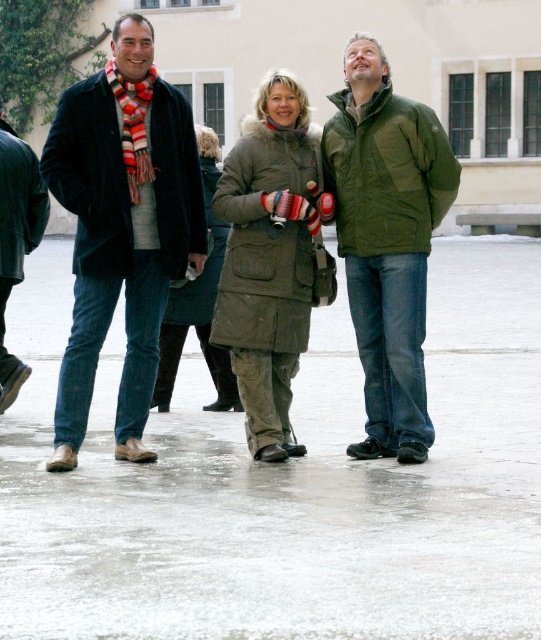
Is velvet black coat at left thinner than matte black jacket at left?

Indeed, velvet black coat at left has a lesser width compared to matte black jacket at left.

Does velvet black coat at left come in front of matte black jacket at left?

Yes, it is in front of matte black jacket at left.

Describe the element at coordinates (122, 227) in the screenshot. This screenshot has height=640, width=541. I see `velvet black coat at left` at that location.

Identify the location of velvet black coat at left. [x=122, y=227].

Which is behind, point (381, 88) or point (267, 172)?

Positioned behind is point (267, 172).

Can you confirm if green matte jacket at center is smaller than olive green parka at center?

Incorrect, green matte jacket at center is not smaller in size than olive green parka at center.

This screenshot has width=541, height=640. I want to click on green matte jacket at center, so click(386, 241).

Is green matte jacket at center closer to the viewer compared to matte black jacket at left?

Yes, green matte jacket at center is in front of matte black jacket at left.

Between green matte jacket at center and matte black jacket at left, which one is positioned higher?

green matte jacket at center is higher up.

Which is in front, point (349, 301) or point (3, 262)?

Point (349, 301)

Find the location of `green matte jacket at center`. green matte jacket at center is located at coordinates (386, 241).